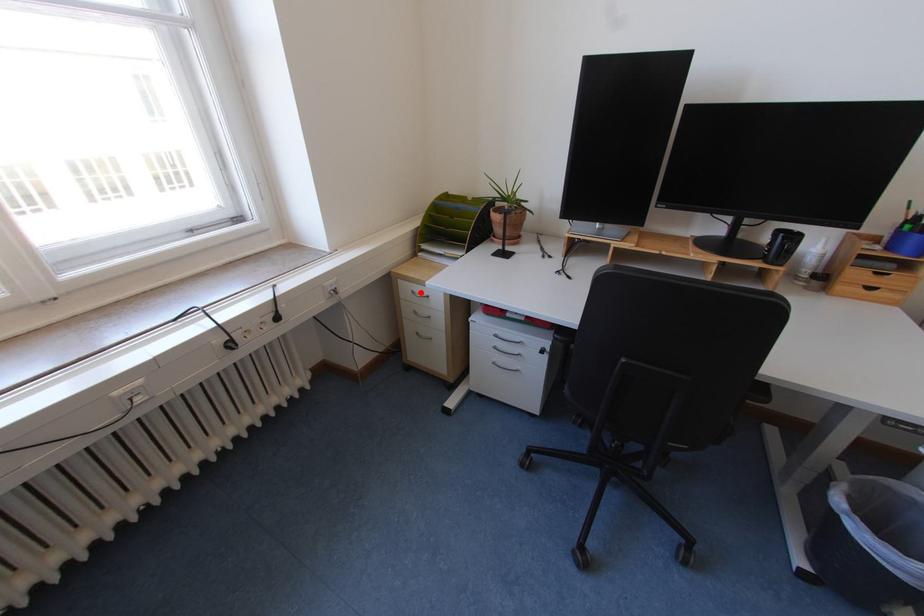
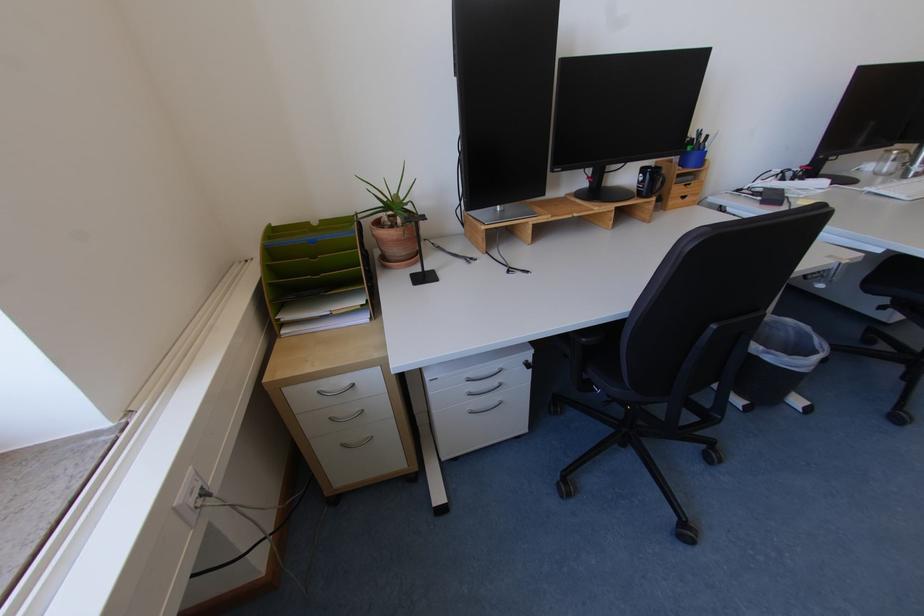
Where in the second image is the point corresponding to the highlighted location from the first image?

(327, 392)